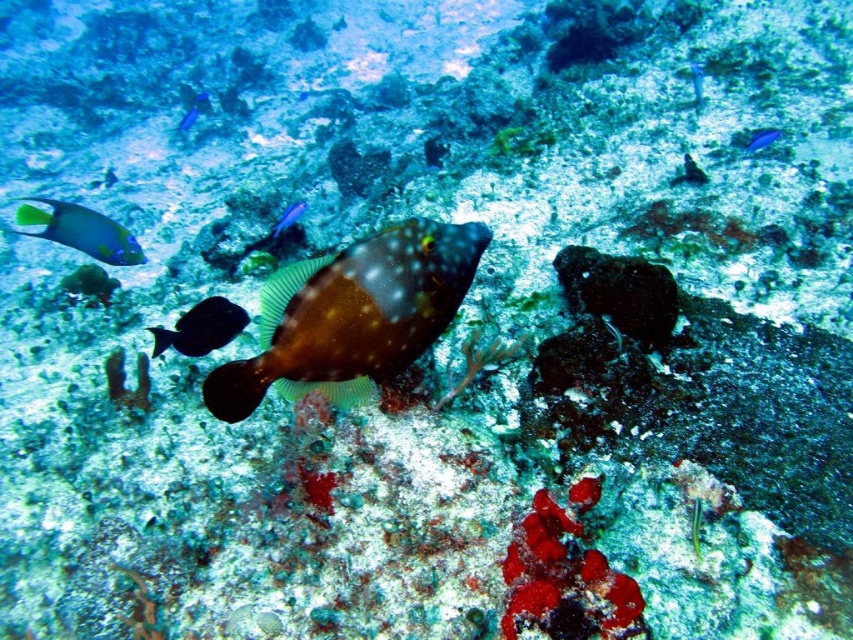
Does shiny green fish at center have a larger size compared to blue glossy fish at upper center?

No.

Is point (693, 525) positioned after point (695, 68)?

That is False.

At what (x,y) coordinates should I click in order to perform the action: click on shiny green fish at center. Please return your answer as a coordinate pair (x, y). This screenshot has height=640, width=853. Looking at the image, I should click on coord(695,525).

Can you confirm if brown glossy fish at center is positioned to the right of shiny blue fish at upper left?

Yes, brown glossy fish at center is to the right of shiny blue fish at upper left.

Describe the element at coordinates (352, 316) in the screenshot. The height and width of the screenshot is (640, 853). I see `brown glossy fish at center` at that location.

You are a GUI agent. You are given a task and a screenshot of the screen. Output one action in this format:
    pyautogui.click(x=<x>, y=<y>)
    Task: Click on the brown glossy fish at center
    
    Given the screenshot: What is the action you would take?
    pyautogui.click(x=352, y=316)

Which is behind, point (764, 138) or point (697, 65)?

Positioned behind is point (697, 65).

Is point (747, 148) behind point (699, 90)?

No, (747, 148) is in front of (699, 90).

Between point (751, 141) and point (694, 76), which one is positioned behind?

The point (694, 76) is behind.

Identify the location of blue glossy fish at upper right. This screenshot has height=640, width=853. (762, 140).